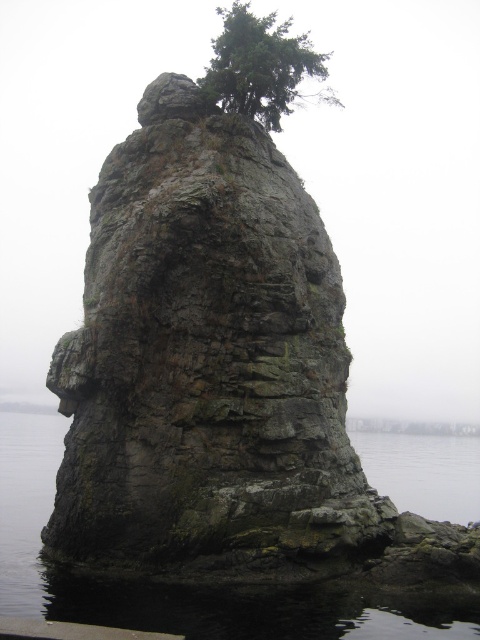
You are standing on a boat in the bay and see the dark gray water at lower center and the transparent water at lower right. Which body of water would allow you to see fish swimming underneath more clearly?

The transparent water at lower right allows you to see fish swimming underneath more clearly because it is clearer than the dark gray water at lower center.

You are a bird looking for a place to perch. You see the green rough textured tree at upper center and the transparent water at lower right. Which location is taller?

The green rough textured tree at upper center is taller than the transparent water at lower right.

You are a photographer wanting to capture the green rough textured tree at upper center and the transparent water at lower right in the same frame. Which object will appear narrower in the photo?

The green rough textured tree at upper center is thinner than transparent water at lower right, so it will appear narrower in the photo.